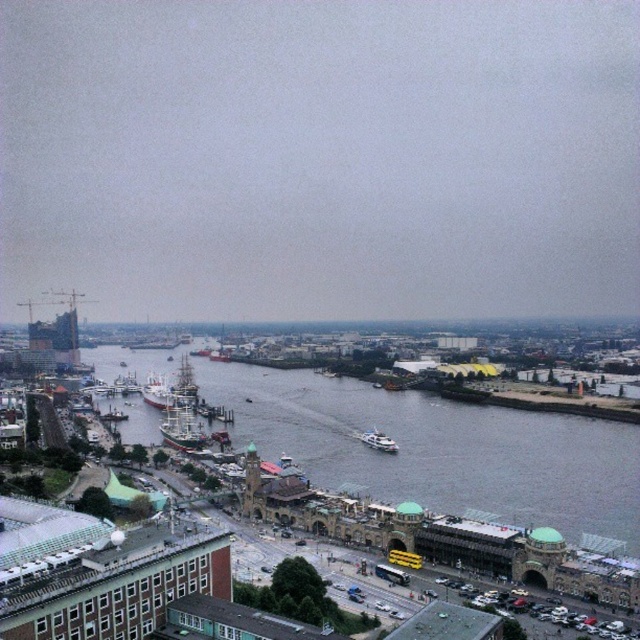
Question: Which object is farther from the camera taking this photo?

Choices:
 (A) white glossy boat at center
 (B) gray water at center

Answer: (A)

Question: Does gray water at center have a larger size compared to green wooden ship at center?

Choices:
 (A) no
 (B) yes

Answer: (B)

Question: Does gray water at center have a larger size compared to white glossy boat at center?

Choices:
 (A) yes
 (B) no

Answer: (A)

Question: Which point is closer to the camera?

Choices:
 (A) white glossy boat at center
 (B) gray water at center
 (C) green wooden ship at center

Answer: (B)

Question: Can you confirm if gray water at center is smaller than white glossy boat at center?

Choices:
 (A) yes
 (B) no

Answer: (B)

Question: Which point is farther to the camera?

Choices:
 (A) green wooden ship at center
 (B) white glossy boat at center

Answer: (B)